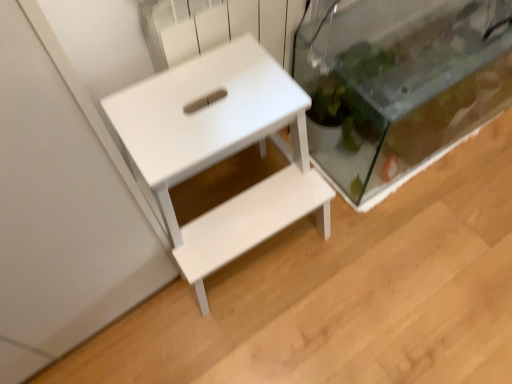
The image size is (512, 384). Describe the element at coordinates (399, 84) in the screenshot. I see `transparent glass tank at right` at that location.

Image resolution: width=512 pixels, height=384 pixels. Identify the location of transparent glass tank at right. (399, 84).

What is the approximate width of white matte table at center?

15.64 inches.

Based on the photo, in order to face white matte table at center, should I rotate leftwards or rightwards?

Turn left approximately 3.624 degrees to face it.

Find the location of `white matte table at center`. white matte table at center is located at coordinates (219, 150).

The height and width of the screenshot is (384, 512). Describe the element at coordinates (219, 150) in the screenshot. I see `white matte table at center` at that location.

Locate an element on the screen. The image size is (512, 384). transparent glass tank at right is located at coordinates (399, 84).

Visually, is white matte table at center positioned to the left or to the right of transparent glass tank at right?

From the image, it's evident that white matte table at center is to the left of transparent glass tank at right.

Between white matte table at center and transparent glass tank at right, which one is positioned behind?

transparent glass tank at right is further away from the camera.

Is point (249, 189) closer or farther from the camera than point (379, 87)?

Point (249, 189) is farther from the camera than point (379, 87).

From the image's perspective, which object appears higher, white matte table at center or transparent glass tank at right?

transparent glass tank at right, from the image's perspective.

From a real-world perspective, is white matte table at center located beneath transparent glass tank at right?

Incorrect, from a real-world perspective, white matte table at center is higher than transparent glass tank at right.

Considering the relative sizes of white matte table at center and transparent glass tank at right in the image provided, is white matte table at center wider than transparent glass tank at right?

Correct, the width of white matte table at center exceeds that of transparent glass tank at right.

In terms of height, does white matte table at center look taller or shorter compared to transparent glass tank at right?

Clearly, white matte table at center is taller compared to transparent glass tank at right.

In terms of size, does white matte table at center appear bigger or smaller than transparent glass tank at right?

white matte table at center is smaller than transparent glass tank at right.

Is white matte table at center completely or partially outside of transparent glass tank at right?

That's correct, white matte table at center is outside of transparent glass tank at right.

Is white matte table at center placed right next to transparent glass tank at right?

No, white matte table at center is not with transparent glass tank at right.

Based on the photo, is white matte table at center aimed at transparent glass tank at right?

No, white matte table at center is not facing towards transparent glass tank at right.

Can you tell me how much white matte table at center and transparent glass tank at right differ in facing direction?

1.16 degrees.

Locate an element on the screen. Image resolution: width=512 pixels, height=384 pixels. glass box above the white matte table at center (from the image's perspective) is located at coordinates (399, 84).

From the picture: Visually, is transparent glass tank at right positioned to the left or to the right of white matte table at center?

transparent glass tank at right is to the right of white matte table at center.

In the image, is transparent glass tank at right positioned in front of or behind white matte table at center?

transparent glass tank at right is positioned farther from the viewer than white matte table at center.

Which is in front, point (357, 14) or point (213, 52)?

The point (213, 52) is more forward.

From the image's perspective, is transparent glass tank at right above white matte table at center?

Yes, from the image's perspective, transparent glass tank at right is over white matte table at center.

From a real-world perspective, relative to white matte table at center, is transparent glass tank at right vertically above or below?

transparent glass tank at right is situated lower than white matte table at center in the real world.

Considering the sizes of transparent glass tank at right and white matte table at center in the image, is transparent glass tank at right wider or thinner than white matte table at center?

Considering their sizes, transparent glass tank at right looks slimmer than white matte table at center.

Can you confirm if transparent glass tank at right is shorter than white matte table at center?

Yes.

Is transparent glass tank at right bigger or smaller than white matte table at center?

transparent glass tank at right is bigger than white matte table at center.

Is transparent glass tank at right completely or partially outside of white matte table at center?

Yes, transparent glass tank at right is located beyond the bounds of white matte table at center.

From the picture: Is transparent glass tank at right not near white matte table at center?

No.

Is transparent glass tank at right aimed at white matte table at center?

No.

I want to click on glass box located behind the white matte table at center, so click(399, 84).

Find the location of a particular element. The height and width of the screenshot is (384, 512). table that appears below the transparent glass tank at right (from the image's perspective) is located at coordinates (219, 150).

The image size is (512, 384). I want to click on glass box above the white matte table at center (from the image's perspective), so click(399, 84).